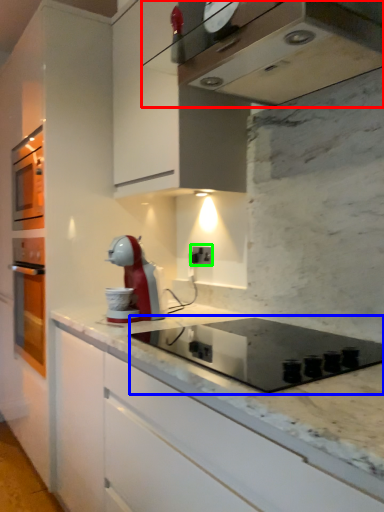
Question: Estimate the real-world distances between objects in this image. Which object is closer to home appliance (highlighted by a red box), appliance (highlighted by a blue box) or electric outlet (highlighted by a green box)?

Choices:
 (A) appliance
 (B) electric outlet

Answer: (A)